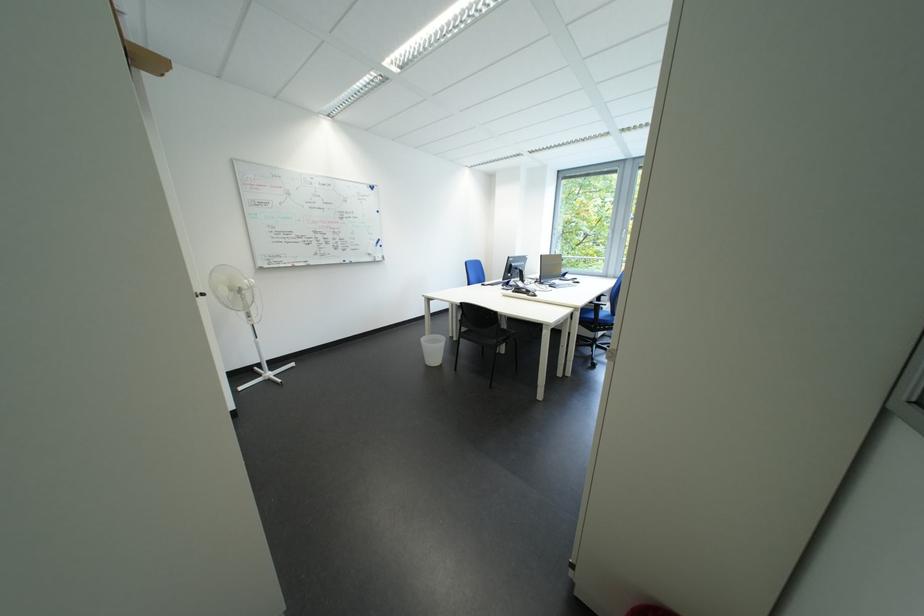
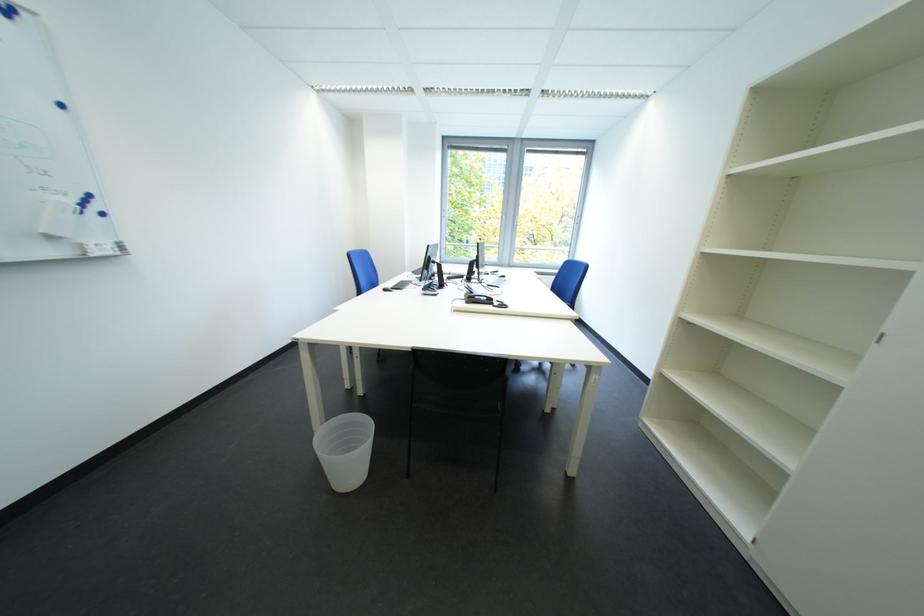
Where in the second image is the point corresponding to the point at 390,262 from the first image?

(108, 256)